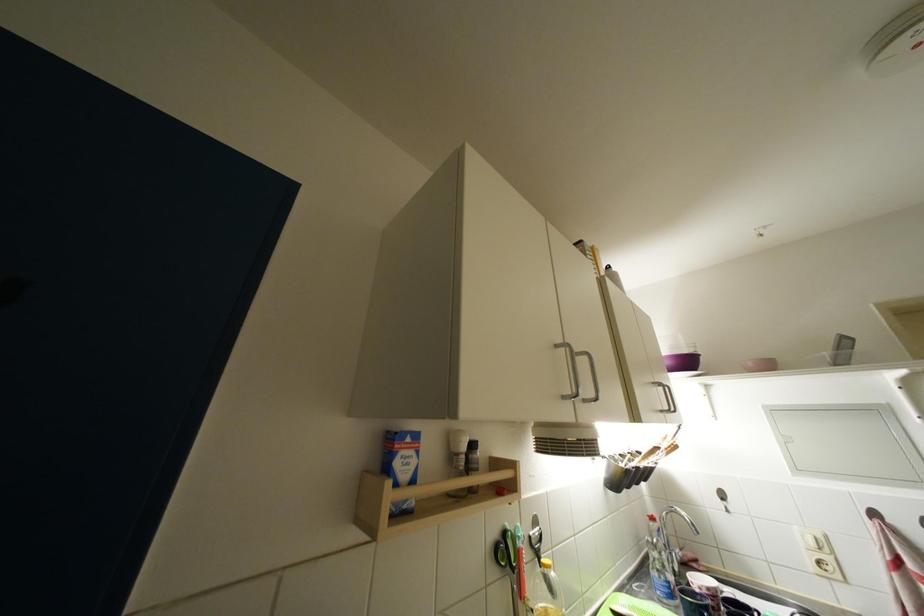
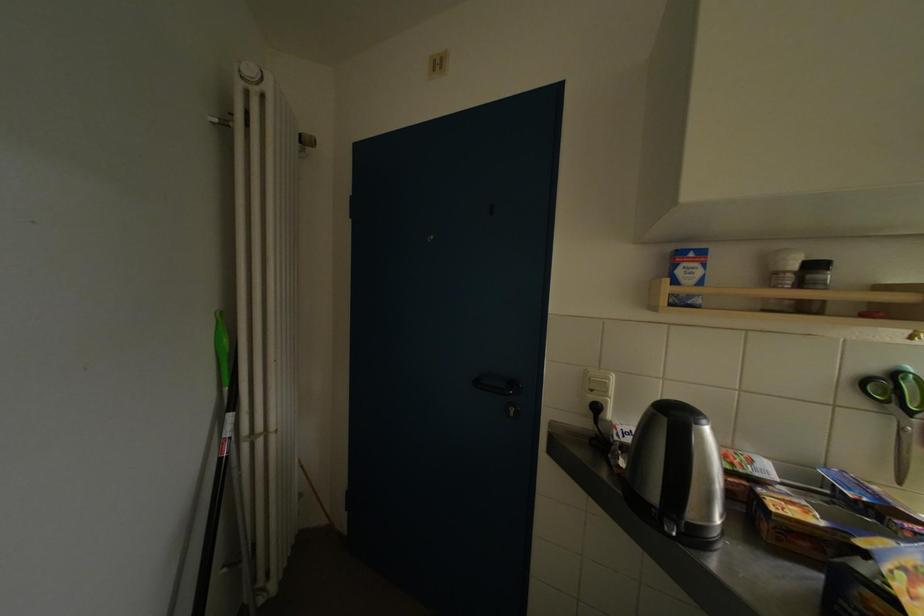
Where in the second image is the point corresponding to point (404, 467) from the first image?

(686, 276)